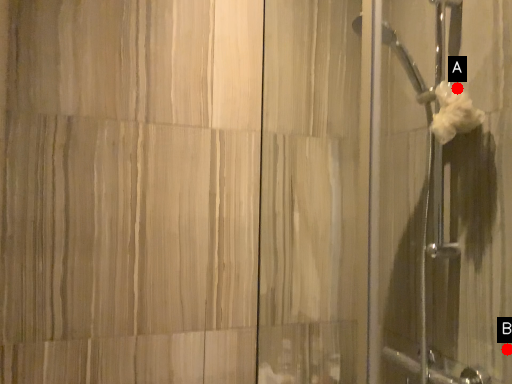
Question: Two points are circled on the image, labeled by A and B beside each circle. Which point appears closest to the camera in this image?

Choices:
 (A) A is closer
 (B) B is closer

Answer: (B)